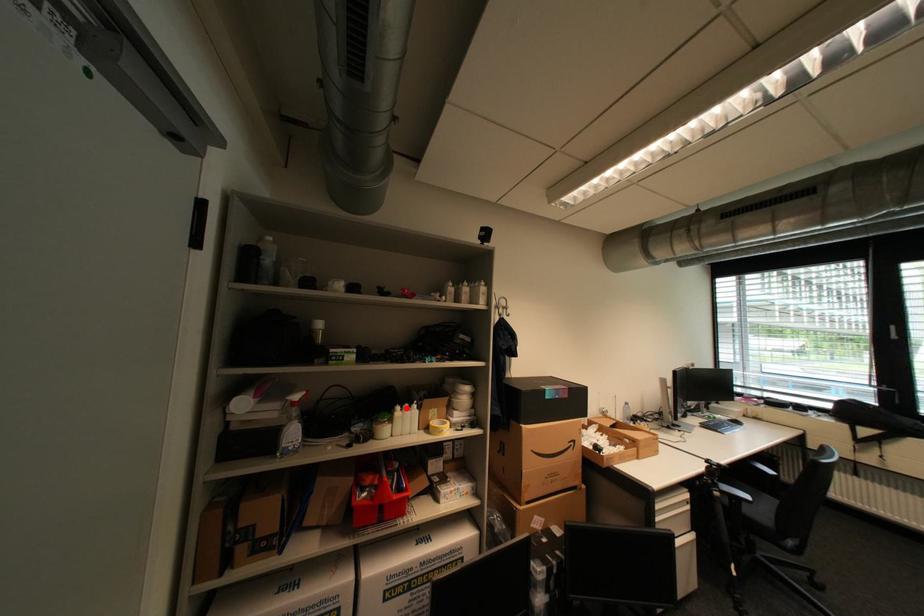
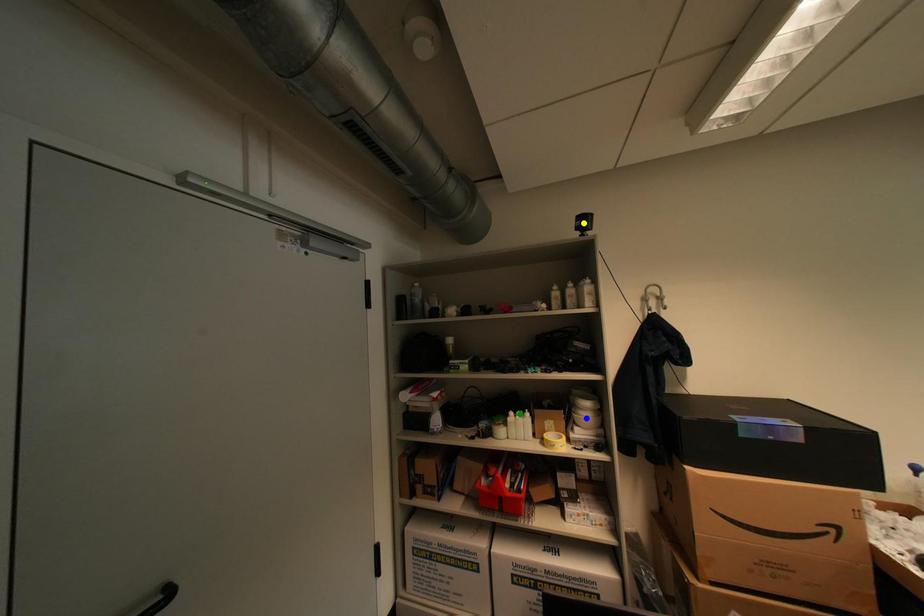
Question: I am providing you with two images of the same scene from different viewpoints. A red point is marked on the first image. You are given multiple points on the second image. Which mark in image 2 goes with the point in image 1?

Choices:
 (A) green point
 (B) blue point
 (C) yellow point

Answer: (A)